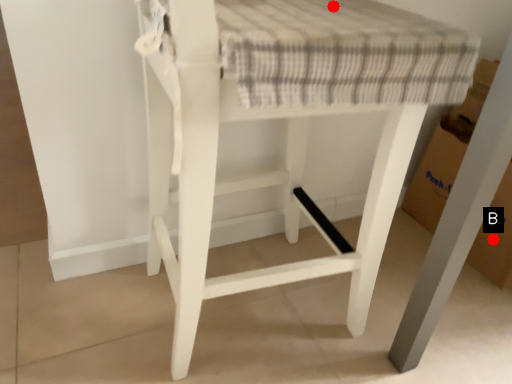
Question: Two points are circled on the image, labeled by A and B beside each circle. Which of the following is the farthest from the observer?

Choices:
 (A) A is further
 (B) B is further

Answer: (B)